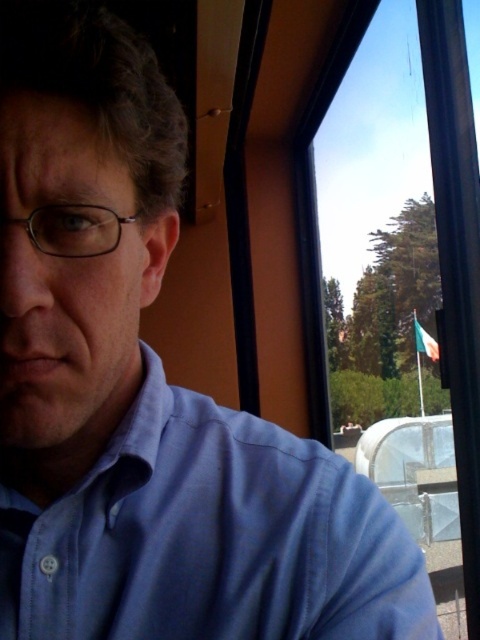
You are a passenger sitting in the train car. You notice the blue cotton dress shirt at upper left and the transparent glass window at upper right. Which object is wider?

The blue cotton dress shirt at upper left is wider than the transparent glass window at upper right.